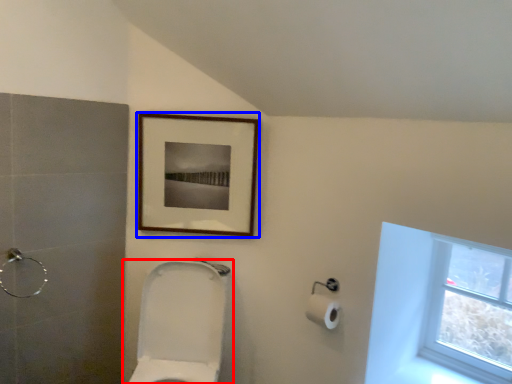
Question: Among these objects, which one is farthest to the camera, toilet (highlighted by a red box) or picture frame (highlighted by a blue box)?

Choices:
 (A) toilet
 (B) picture frame

Answer: (B)